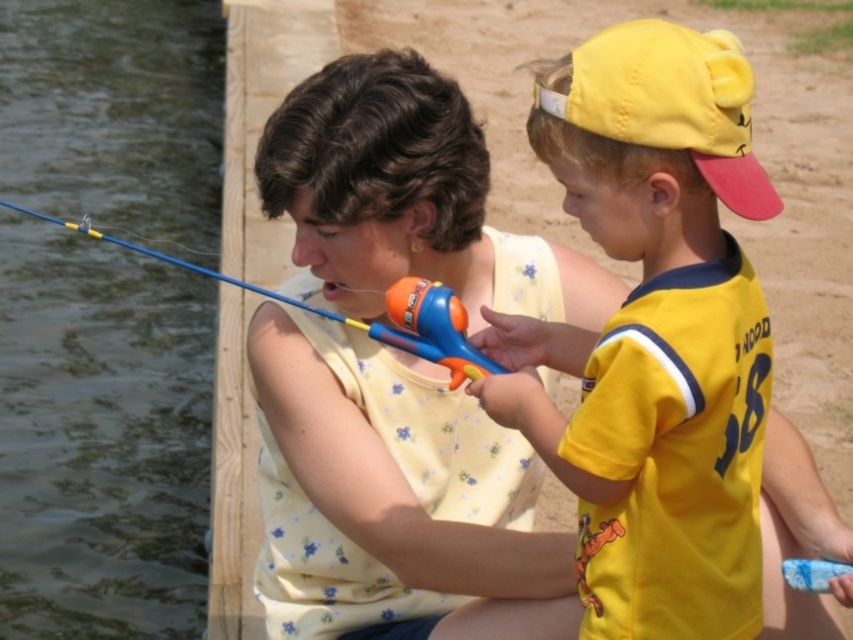
You are standing at the origin point in the image. There are two points marked in the image. Which point is closer to you, point (149, 538) or point (810, 573)?

Point (810, 573) is closer to you because it is in front of point (149, 538).

You are a photographer trying to capture a photo of the yellow fabric baseball cap at upper right and the blue plastic fishing pole at upper left. If you want to make sure both objects are fully visible in the frame, which object should you adjust your focus on first?

The yellow fabric baseball cap at upper right is taller than the blue plastic fishing pole at upper left, so you should adjust your focus on the yellow fabric baseball cap at upper right first to ensure it fits within the frame.

You are standing at the camera position and want to hand the blue plastic fishing pole at upper left to someone behind you. Is the fishing pole within your reach if your maximum reach is 2 meters?

The blue plastic fishing pole at upper left is 2.83 meters from the camera, which is beyond your 2 meter reach. You cannot reach it from the camera position.